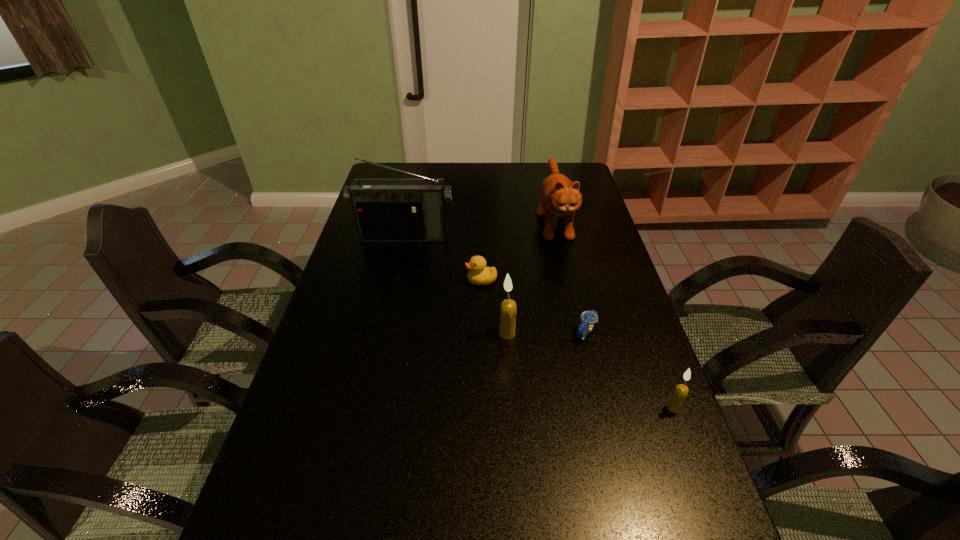
Where is `vacant spot to place a candle on the left`? The width and height of the screenshot is (960, 540). vacant spot to place a candle on the left is located at coordinates (383, 278).